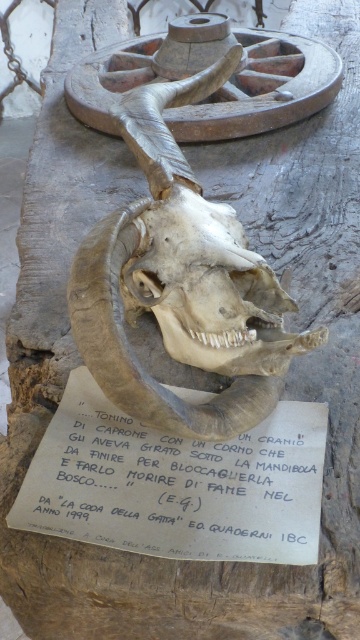
Who is shorter, brown leather skull at center or white paper at center?

white paper at center is shorter.

Can you confirm if brown leather skull at center is bigger than white paper at center?

Indeed, brown leather skull at center has a larger size compared to white paper at center.

Which is in front, point (230, 90) or point (198, 476)?

Point (198, 476)

Find the location of a particular element. brown leather skull at center is located at coordinates (187, 225).

Between point (262, 340) and point (183, 275), which one is positioned in front?

Point (262, 340) is more forward.

In order to click on brown leather skull at center in this screenshot , I will do pos(187,225).

Can you confirm if white paper at center is positioned above brown textured skull at center?

Actually, white paper at center is below brown textured skull at center.

The height and width of the screenshot is (640, 360). Describe the element at coordinates (177, 484) in the screenshot. I see `white paper at center` at that location.

At what (x,y) coordinates should I click in order to perform the action: click on white paper at center. Please return your answer as a coordinate pair (x, y). Looking at the image, I should click on (177, 484).